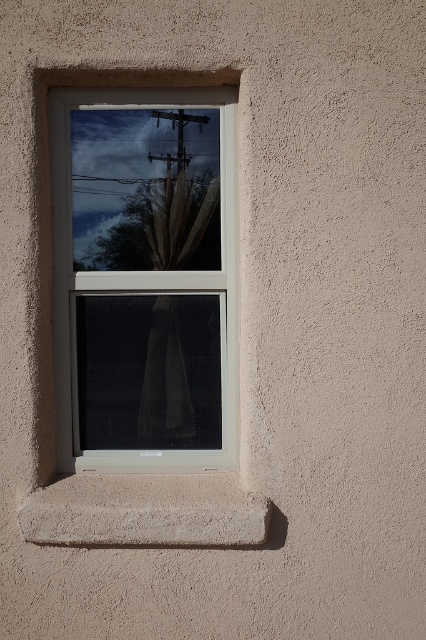
Based on the photo, between white plastic window frame at center and white sheer curtain at center, which one has less height?

white sheer curtain at center

Can you confirm if white plastic window frame at center is bigger than white sheer curtain at center?

Indeed, white plastic window frame at center has a larger size compared to white sheer curtain at center.

Who is more distant from viewer, (51, 154) or (189, 250)?

Point (189, 250)

The image size is (426, 640). What are the coordinates of `white plastic window frame at center` in the screenshot? It's located at (144, 269).

Who is shorter, smooth concrete window sill at lower center or white sheer curtain at center?

smooth concrete window sill at lower center

Which is in front, point (108, 499) or point (161, 420)?

Point (108, 499)

You are a GUI agent. You are given a task and a screenshot of the screen. Output one action in this format:
    pyautogui.click(x=<x>, y=<y>)
    Task: Click on the smooth concrete window sill at lower center
    This screenshot has width=426, height=640.
    Given the screenshot: What is the action you would take?
    pyautogui.click(x=144, y=512)

Who is positioned more to the right, white plastic window frame at center or smooth concrete window sill at lower center?

Positioned to the right is smooth concrete window sill at lower center.

Who is taller, white plastic window frame at center or smooth concrete window sill at lower center?

Standing taller between the two is white plastic window frame at center.

Is point (89, 460) farther from camera compared to point (210, 476)?

Yes.

You are a GUI agent. You are given a task and a screenshot of the screen. Output one action in this format:
    pyautogui.click(x=<x>, y=<y>)
    Task: Click on the white plastic window frame at center
    Image resolution: width=426 pixels, height=640 pixels.
    Given the screenshot: What is the action you would take?
    pyautogui.click(x=144, y=269)